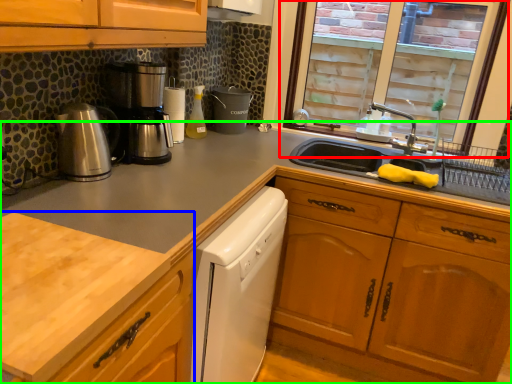
Question: Estimate the real-world distances between objects in this image. Which object is closer to window (highlighted by a red box), countertop (highlighted by a blue box) or cabinetry (highlighted by a green box)?

Choices:
 (A) countertop
 (B) cabinetry

Answer: (B)